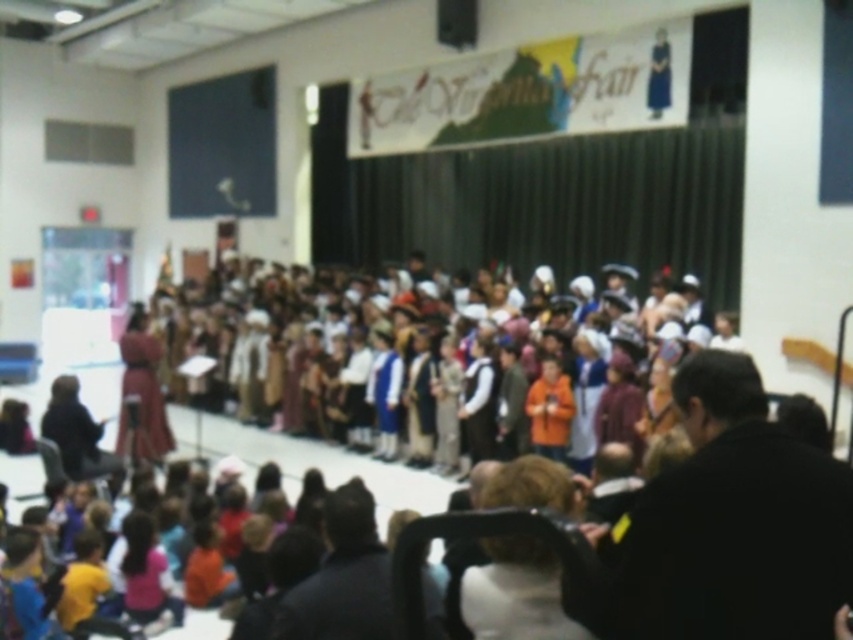
Question: Can you confirm if dark fabric chair at lower left is positioned above velvet maroon dress at center?

Choices:
 (A) no
 (B) yes

Answer: (A)

Question: Which of the following is the farthest from the observer?

Choices:
 (A) (74, 456)
 (B) (410, 310)
 (C) (711, 388)

Answer: (B)

Question: Is dark hair at lower center to the left of velvet maroon dress at center from the viewer's perspective?

Choices:
 (A) yes
 (B) no

Answer: (B)

Question: Does dark hair at lower center appear on the left side of velvet maroon dress at center?

Choices:
 (A) yes
 (B) no

Answer: (B)

Question: Which point is farther from the camera taking this photo?

Choices:
 (A) (529, 394)
 (B) (300, 605)
 (C) (287, 403)
 (D) (479, 368)

Answer: (C)

Question: Which of these objects is positioned farthest from the velvet brown vest at center?

Choices:
 (A) dark fabric chair at lower left
 (B) dark hair at lower center
 (C) multicolored fabric costumes at center

Answer: (B)